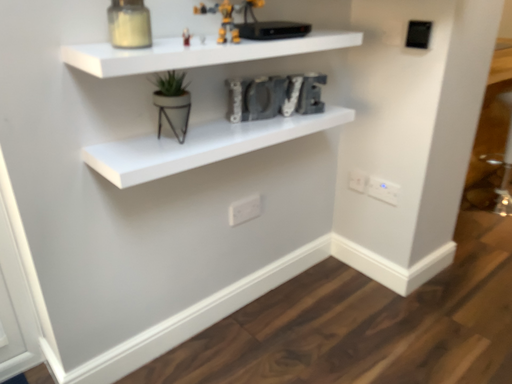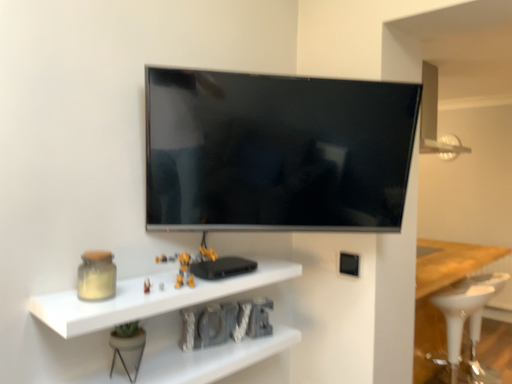
Question: Which way did the camera rotate in the video?

Choices:
 (A) rotated upward
 (B) rotated downward

Answer: (A)